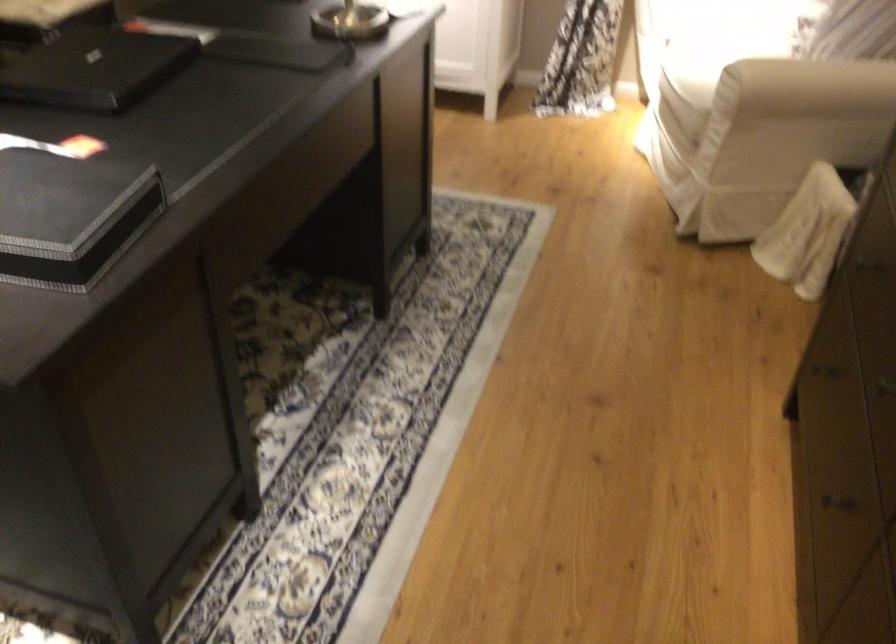
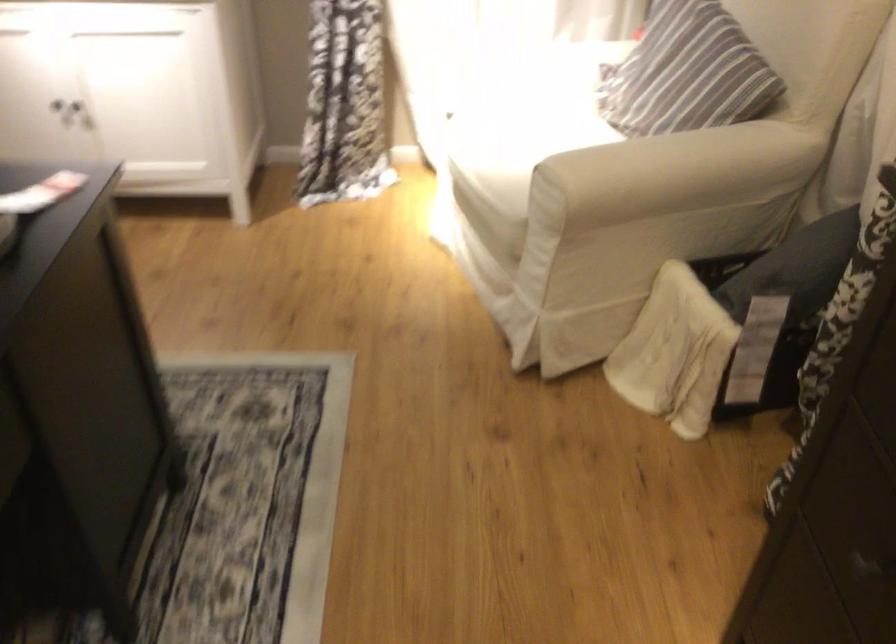
Question: In a continuous first-person perspective shot, in which direction is the camera moving?

Choices:
 (A) Left
 (B) Right
 (C) Forward
 (D) Backward

Answer: (C)